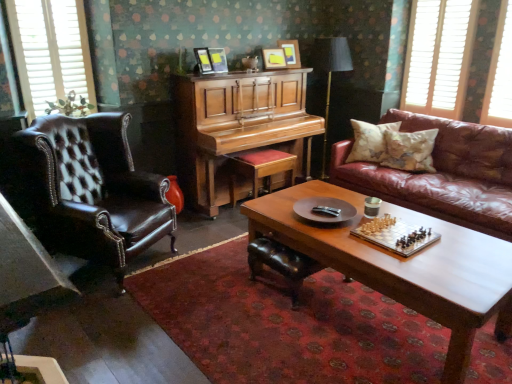
Find the location of `unoccupied region to the right of brown leather wingback chair at left`. unoccupied region to the right of brown leather wingback chair at left is located at coordinates (205, 270).